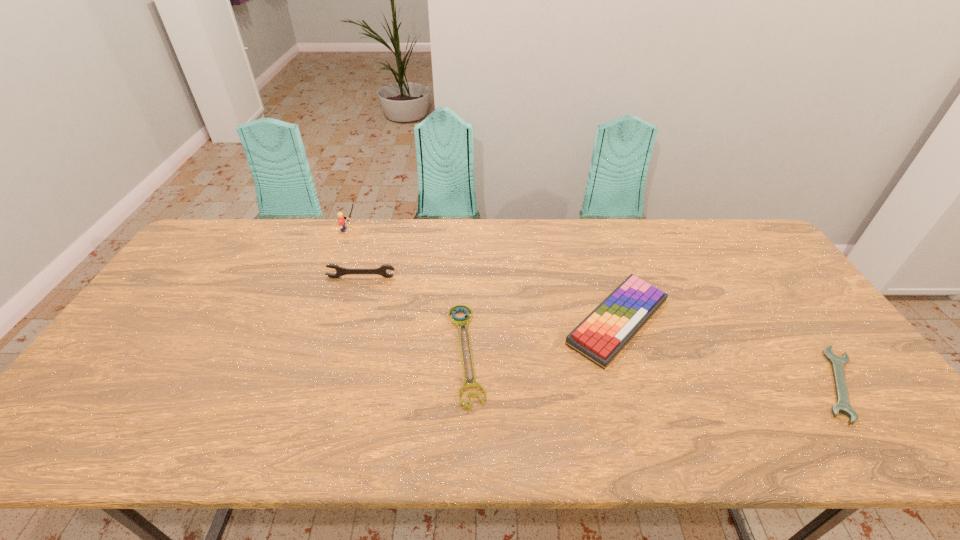
Identify the location of Lego. This screenshot has height=540, width=960. (341, 219).

Locate an element on the screen. This screenshot has width=960, height=540. the farthest object is located at coordinates (341, 219).

You are a GUI agent. You are given a task and a screenshot of the screen. Output one action in this format:
    pyautogui.click(x=<x>, y=<y>)
    Task: Click on the fourth nearest object
    The height and width of the screenshot is (540, 960).
    Given the screenshot: What is the action you would take?
    pyautogui.click(x=340, y=271)

This screenshot has width=960, height=540. Find the location of `the tallest wrench`. the tallest wrench is located at coordinates (340, 271).

In order to click on the fourth object from left to right in this screenshot , I will do `click(600, 337)`.

You are a GUI agent. You are given a task and a screenshot of the screen. Output one action in this format:
    pyautogui.click(x=<x>, y=<y>)
    Task: Click on the computer keyboard
    Image resolution: width=960 pixels, height=540 pixels.
    Given the screenshot: What is the action you would take?
    pyautogui.click(x=600, y=337)

At what (x,y) coordinates should I click in order to perform the action: click on the third object from left to right. Please return your answer as a coordinate pair (x, y). Looking at the image, I should click on (466, 319).

Find the location of `the rightmost object`. the rightmost object is located at coordinates (837, 362).

Find the location of `vacant space situated 0.390m on the front-facing side of the tallest object`. vacant space situated 0.390m on the front-facing side of the tallest object is located at coordinates (468, 230).

Where is `free space located on the open ends of the leftmost wrench`? free space located on the open ends of the leftmost wrench is located at coordinates (335, 365).